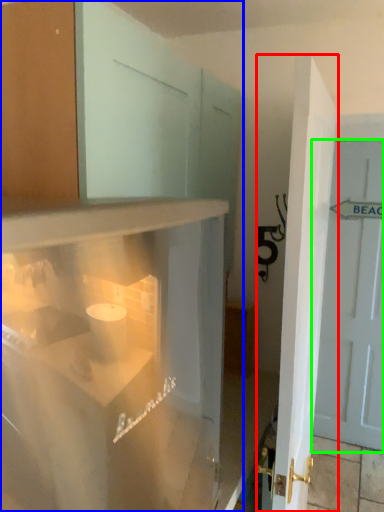
Question: Estimate the real-world distances between objects in this image. Which object is farther from door (highlighted by a red box), cabinetry (highlighted by a blue box) or door (highlighted by a green box)?

Choices:
 (A) cabinetry
 (B) door

Answer: (B)